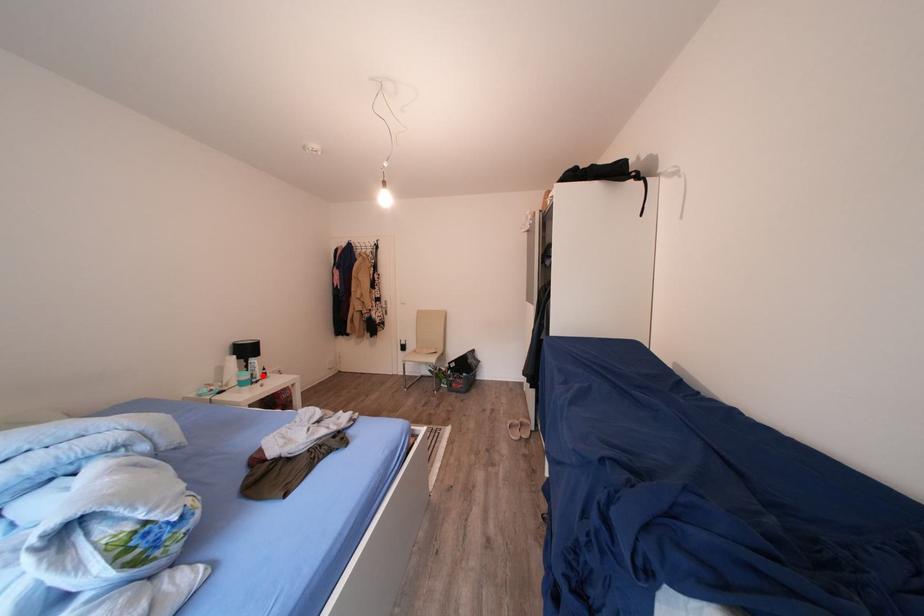
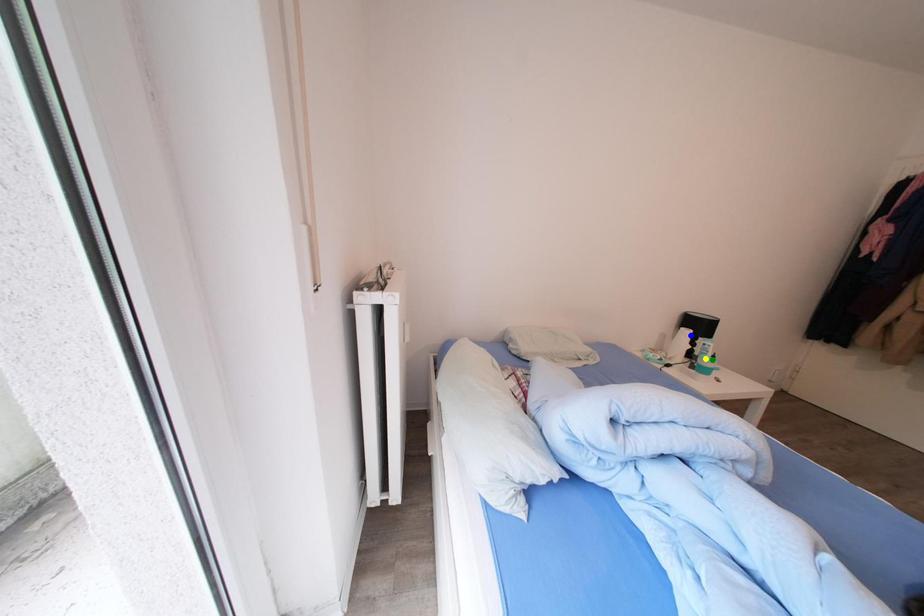
Question: I am providing you with two images of the same scene from different viewpoints. A red point is marked on the first image. You are given multiple points on the second image. Which mark in image 2 goes with the point in image 1?

Choices:
 (A) green point
 (B) yellow point
 (C) blue point

Answer: (A)